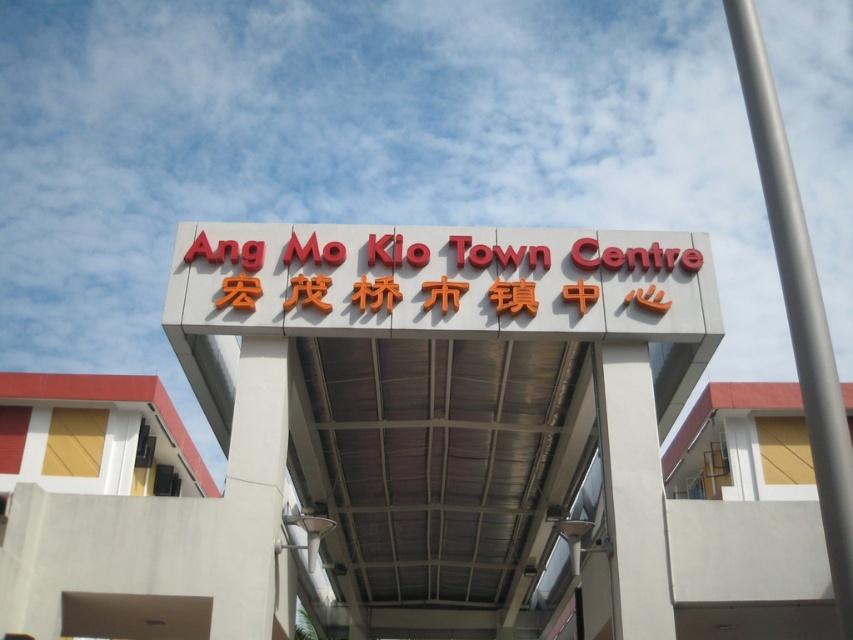
You are standing at the entrance of Ang Mo Kio Town Centre and want to take a photo of the two points mentioned. Which point, point at (809, 266) or point at (669, 252), will appear larger in your camera view?

Point at (809, 266) will appear larger in your camera view because it is closer to the camera than point at (669, 252).

You are standing at the entrance of Ang Mo Kio Town Centre and want to find the silver metallic pole at upper right. According to the scene, where should you look relative to the red plastic sign at center?

The silver metallic pole at upper right is positioned under the red plastic sign at center, so you should look below the red plastic sign at center to find it.

You are designing a layout for a new town center and want to ensure that the white matte sign at center is visually dominant compared to the silver metallic pole at upper right. Based on the image provided, does the current size relationship between these two objects meet your design requirement?

Yes, the white matte sign at center has a larger width than the silver metallic pole at upper right, making it visually dominant as per the design requirement.